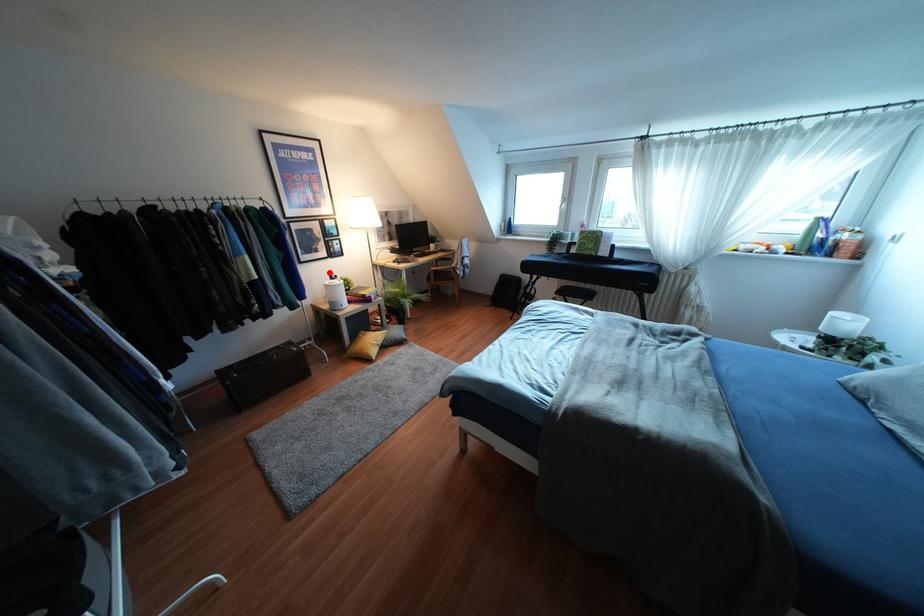
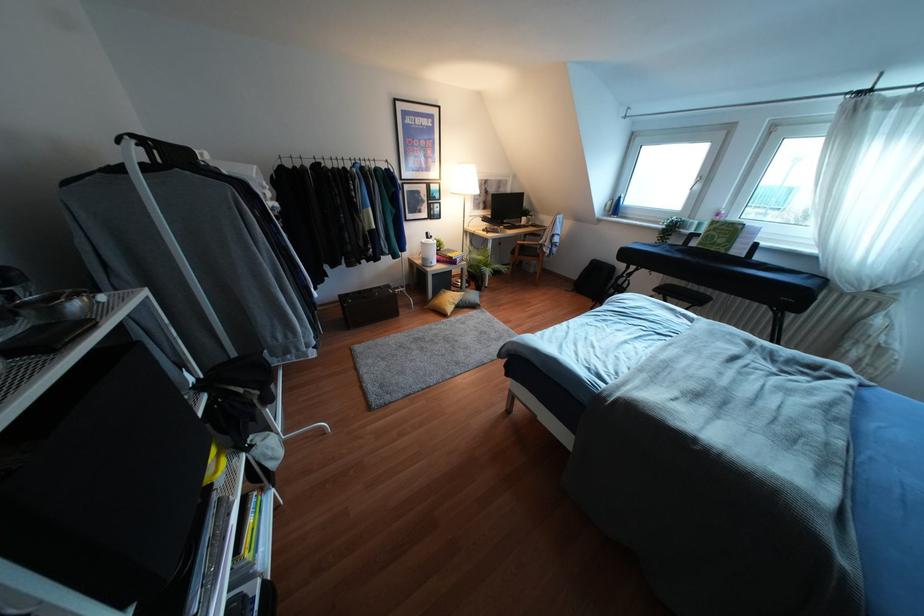
The point at the highlighted location is marked in the first image. Where is the corresponding point in the second image?

(427, 233)